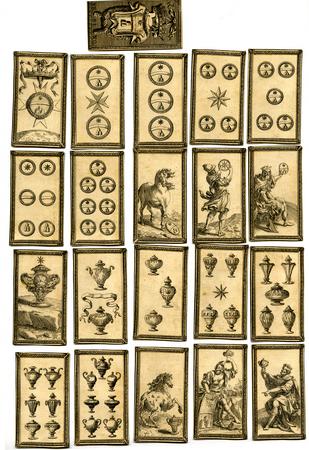
The image size is (309, 450). What are the coordinates of `handle` in the screenshot? It's located at (118, 375), (81, 374).